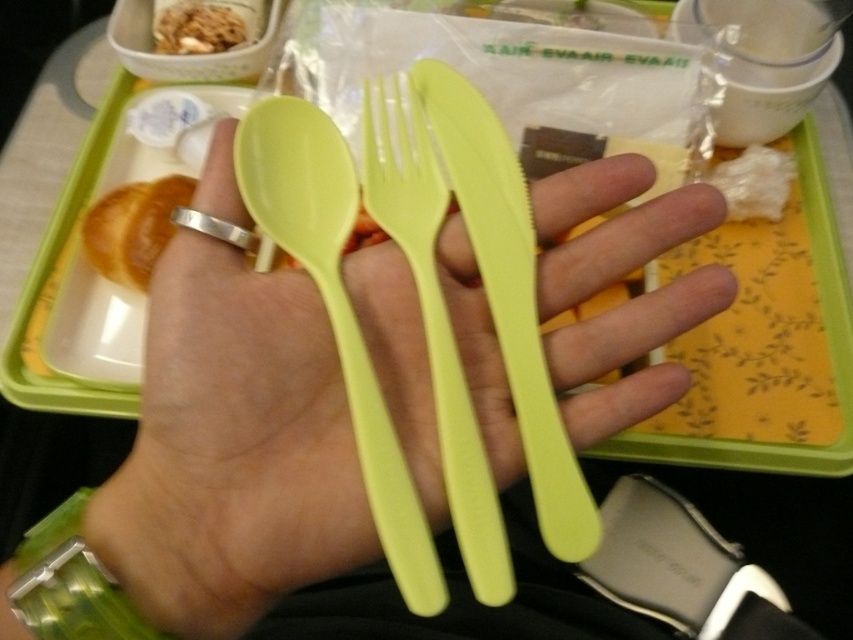
Question: Among these points, which one is nearest to the camera?

Choices:
 (A) (177, 40)
 (B) (450, 296)
 (C) (395, 484)
 (D) (467, 508)

Answer: (C)

Question: Is lime green plastic utensils at center wider than lime green plastic spoon at center?

Choices:
 (A) yes
 (B) no

Answer: (A)

Question: Does lime green plastic spoon at center appear on the right side of brown crumbly at upper left?

Choices:
 (A) no
 (B) yes

Answer: (B)

Question: Does golden brown croissant at left come behind brown crumbly at upper left?

Choices:
 (A) yes
 (B) no

Answer: (B)

Question: Which point is farther to the camera?

Choices:
 (A) lime green plastic utensils at center
 (B) light green plastic fork at center
 (C) brown crumbly at upper left

Answer: (C)

Question: Estimate the real-world distances between objects in this image. Which object is farther from the brown crumbly at upper left?

Choices:
 (A) lime green plastic spoon at center
 (B) lime green plastic utensils at center

Answer: (B)